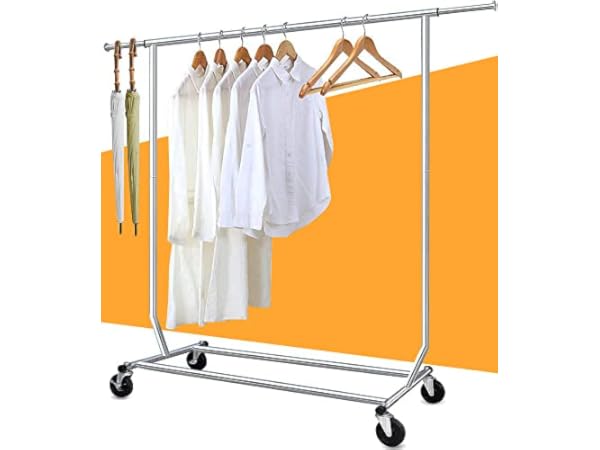
Identify the location of brown wooden hangers. (369, 41), (342, 48), (289, 44), (267, 49), (244, 49), (223, 55), (203, 57).